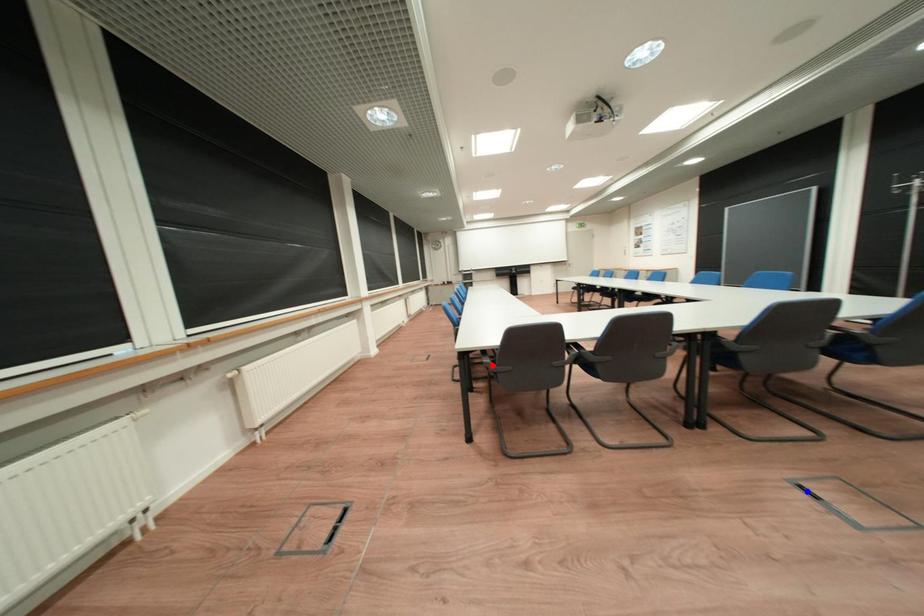
Question: Two points are marked on the image. Which point is closer to the camera?

Choices:
 (A) Blue point is closer.
 (B) Red point is closer.

Answer: (A)